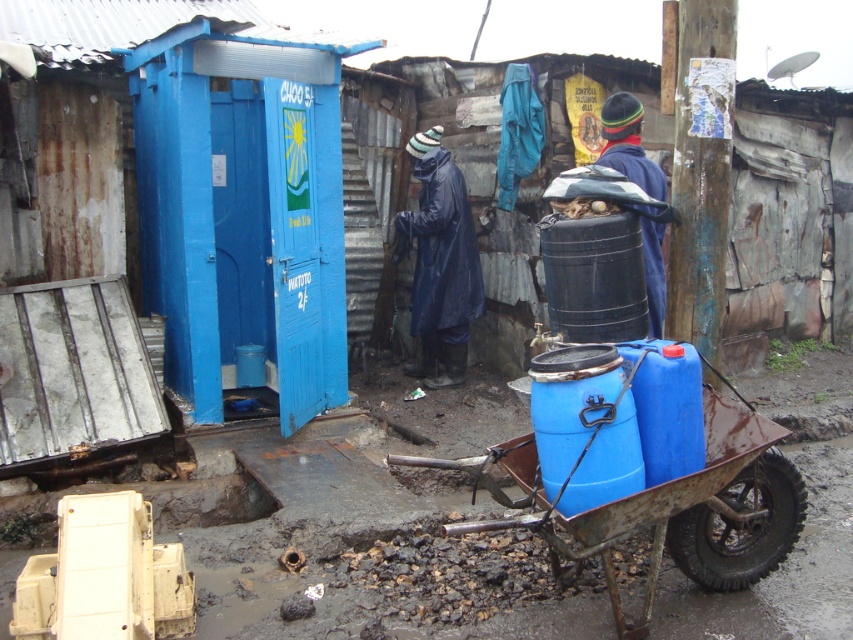
In the scene shown: Is shiny blue raincoat at center positioned before blue fabric jacket at center?

No, shiny blue raincoat at center is further to the viewer.

Can you confirm if shiny blue raincoat at center is shorter than blue fabric jacket at center?

Incorrect, shiny blue raincoat at center's height does not fall short of blue fabric jacket at center's.

Which is in front, point (434, 292) or point (630, 156)?

Positioned in front is point (630, 156).

Find the location of `shiny blue raincoat at center`. shiny blue raincoat at center is located at coordinates (439, 262).

Is point (573, 532) closer to viewer compared to point (659, 280)?

Yes, it is.

Does blue plastic cart at lower center appear on the right side of blue fabric jacket at center?

No, blue plastic cart at lower center is not to the right of blue fabric jacket at center.

Is point (543, 486) more distant than point (653, 333)?

No.

Identify the location of blue plastic cart at lower center. (643, 468).

How far apart are blue plastic cart at lower center and shiny blue raincoat at center?

blue plastic cart at lower center is 3.25 meters away from shiny blue raincoat at center.

Is blue plastic cart at lower center below shiny blue raincoat at center?

Indeed, blue plastic cart at lower center is positioned under shiny blue raincoat at center.

This screenshot has height=640, width=853. Describe the element at coordinates (643, 468) in the screenshot. I see `blue plastic cart at lower center` at that location.

Find the location of a particular element. The width and height of the screenshot is (853, 640). blue plastic cart at lower center is located at coordinates (643, 468).